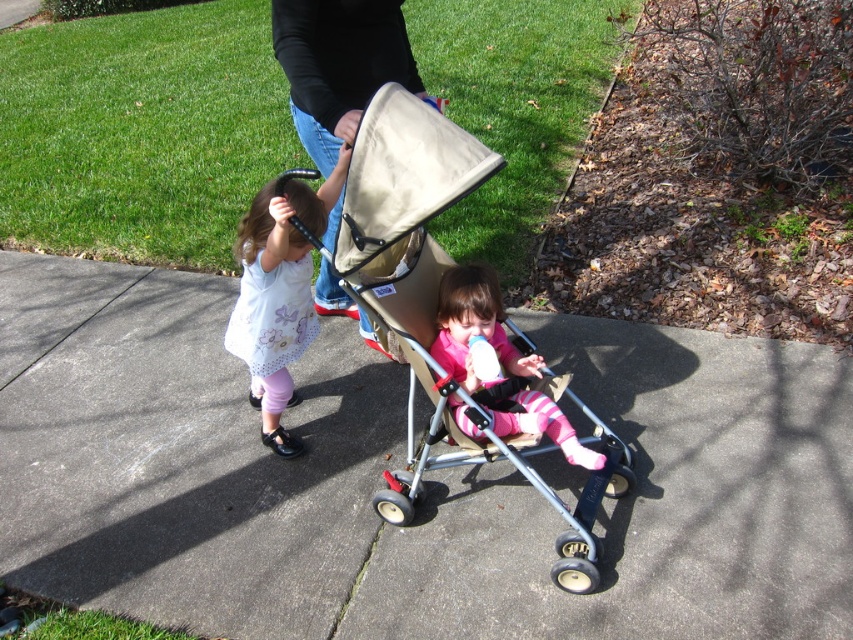
You are a parent trying to ensure the safety of the children in the image. There is a black fabric at upper center marked by point (x=338, y=65). Is this fabric part of the stroller or the child in the white dress?

The black fabric at upper center marked by point (x=338, y=65) is part of the child in the white dress.